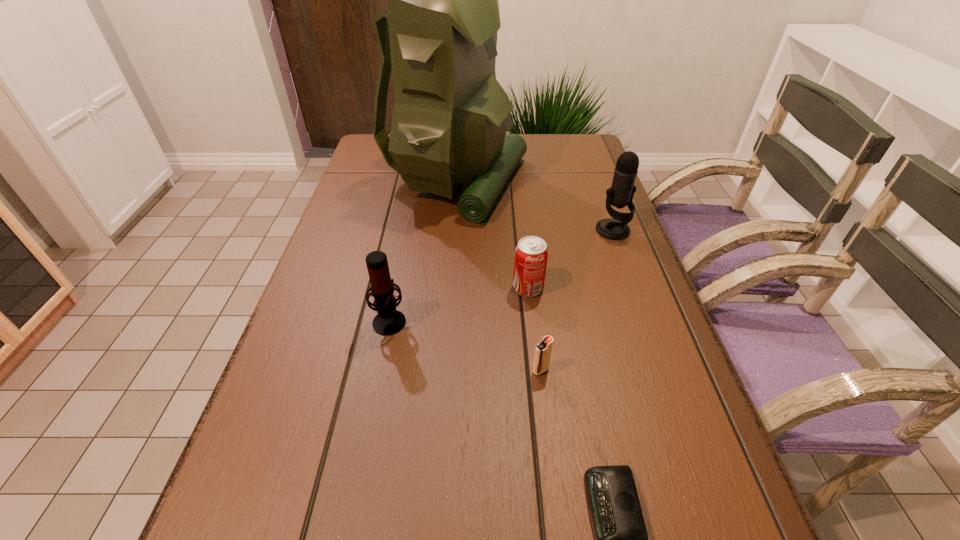
Image resolution: width=960 pixels, height=540 pixels. I want to click on free space at the right edge, so click(x=694, y=432).

Find the location of `free space at the far right corner of the desktop`. free space at the far right corner of the desktop is located at coordinates (550, 155).

Locate an element on the screen. vacant space in between the third nearest object and the soda can is located at coordinates (459, 304).

The width and height of the screenshot is (960, 540). Identify the location of blank region between the second tallest object and the third shortest object. (570, 259).

What are the coordinates of `free space between the shorter microphone and the second nearest object` in the screenshot? It's located at (466, 345).

Find the location of a particular element. The width and height of the screenshot is (960, 540). vacant area that lies between the igniter and the tallest object is located at coordinates (498, 276).

The image size is (960, 540). Find the location of `empty space that is in between the fourth nearest object and the right microphone`. empty space that is in between the fourth nearest object and the right microphone is located at coordinates (570, 259).

Find the location of `unoccupied position between the second nearest object and the fourth shortest object`. unoccupied position between the second nearest object and the fourth shortest object is located at coordinates point(466,345).

Where is `free spot between the tallest object and the taller microphone`? Image resolution: width=960 pixels, height=540 pixels. free spot between the tallest object and the taller microphone is located at coordinates (534, 206).

Where is `object that can be found as the closest to the third farthest object`? object that can be found as the closest to the third farthest object is located at coordinates coord(543,349).